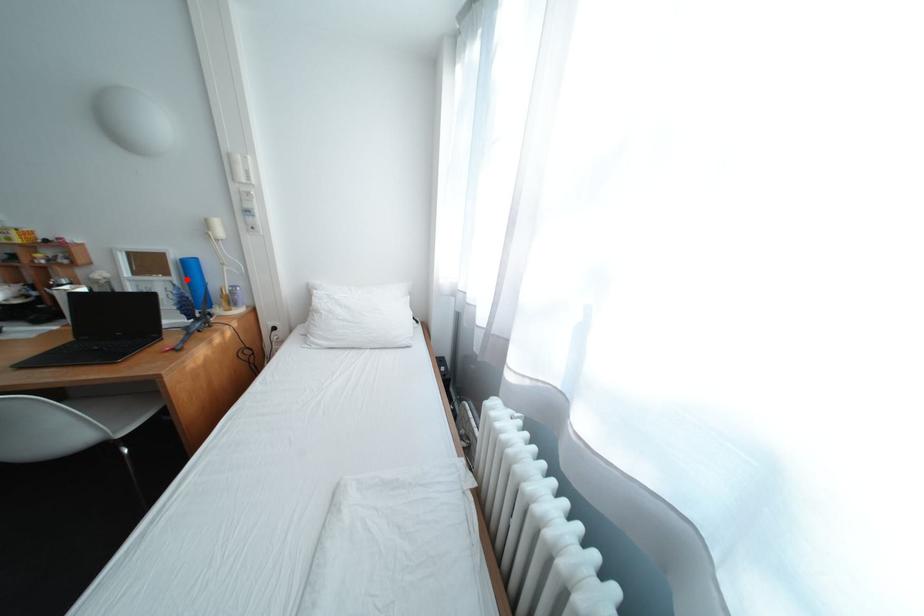
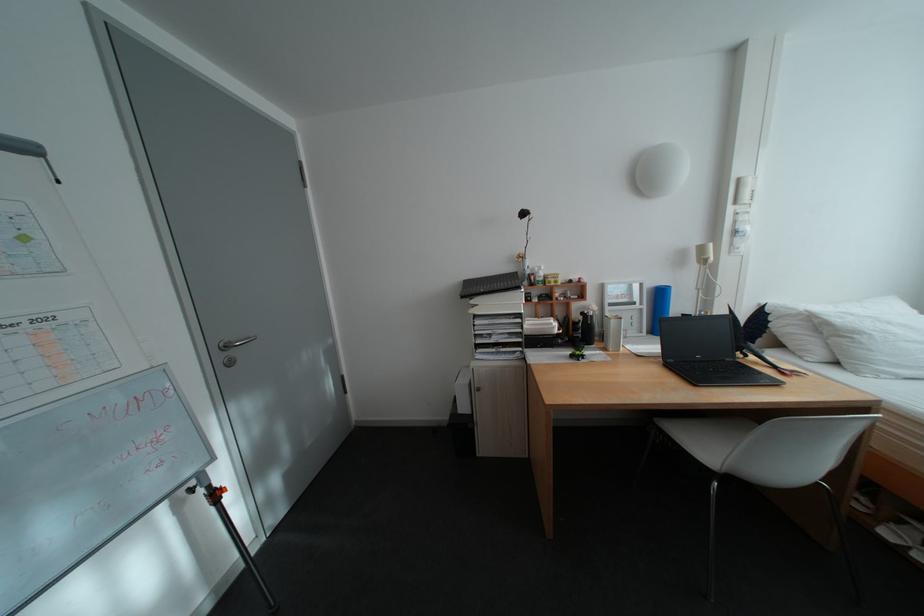
Question: I am providing you with two images of the same scene from different viewpoints. A red point is marked on the first image. At the location where the point appears in image 1, is it still visible in image 2?

Choices:
 (A) Yes
 (B) No

Answer: (A)